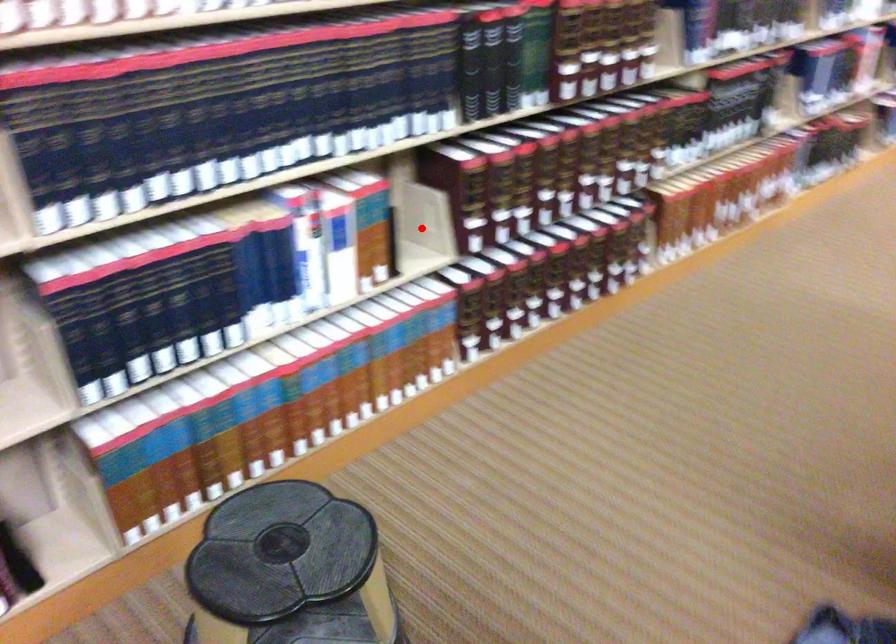
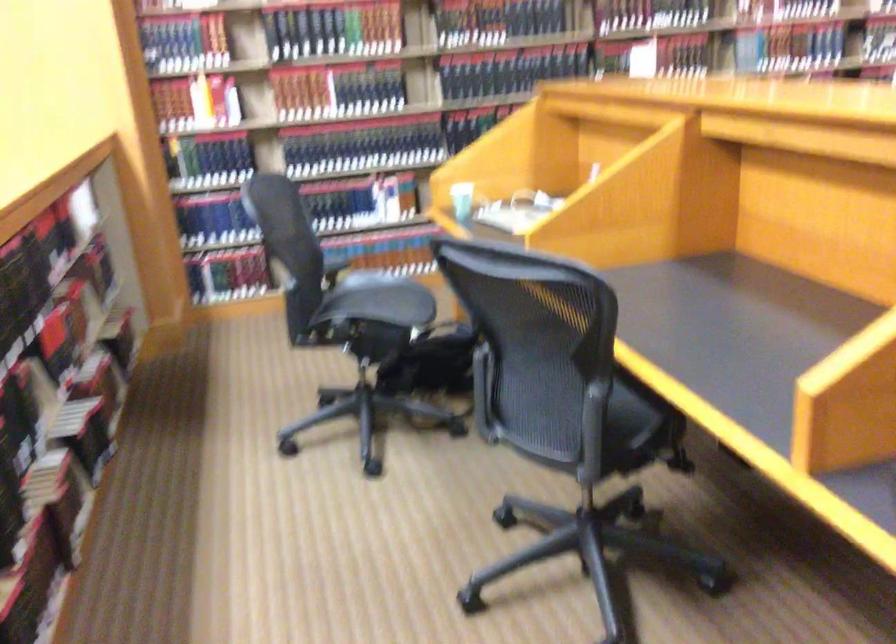
Question: I am providing you with two images of the same scene from different viewpoints. A red point is marked on the first image. At the location where the point appears in image 1, is it still visible in image 2?

Choices:
 (A) Yes
 (B) No

Answer: (B)